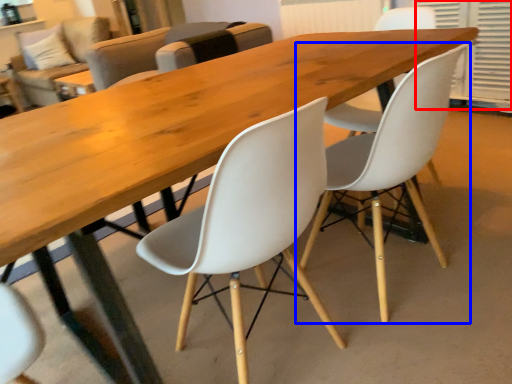
Question: Which point is further to the camera, shutter (highlighted by a red box) or chair (highlighted by a blue box)?

Choices:
 (A) shutter
 (B) chair

Answer: (A)